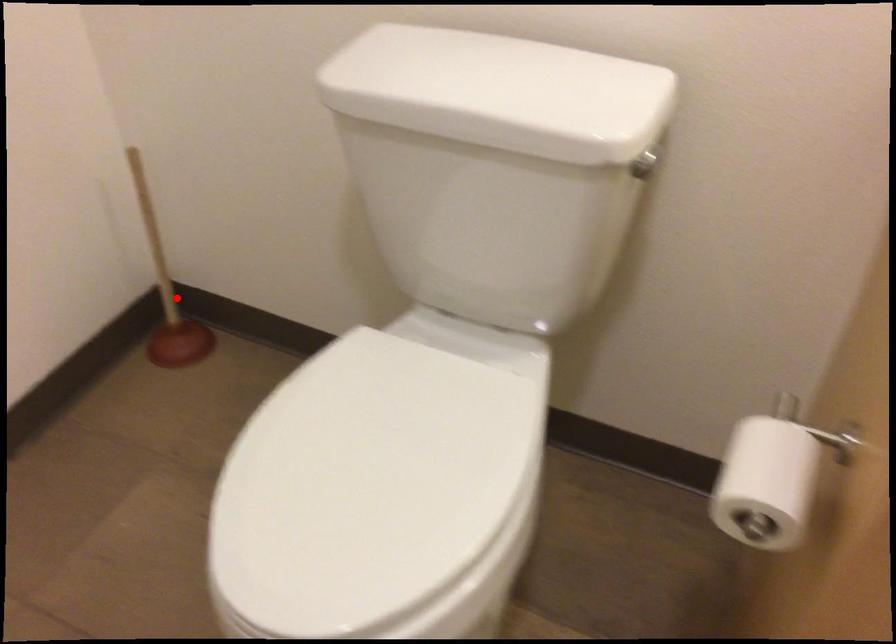
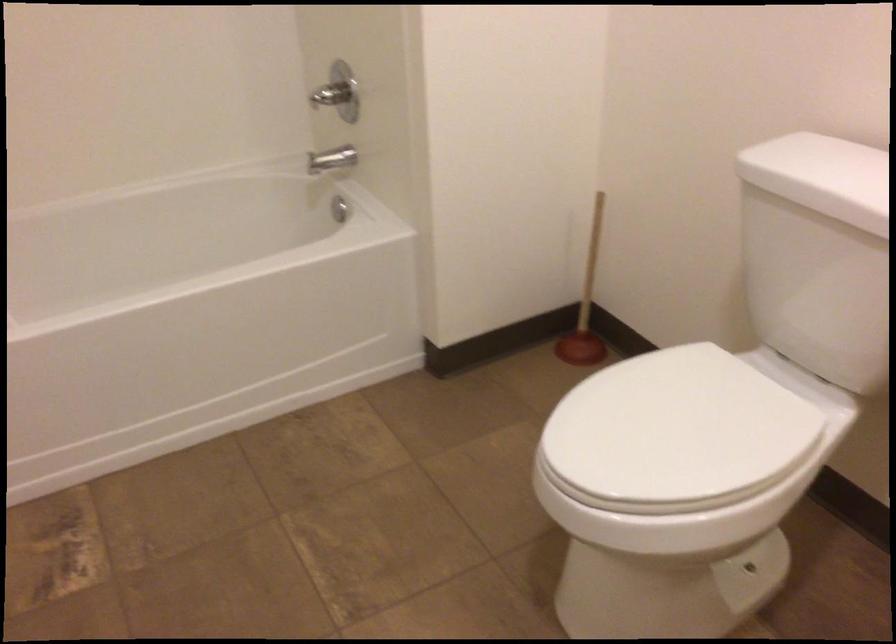
In the second image, find the point that corresponds to the highlighted location in the first image.

(586, 305)